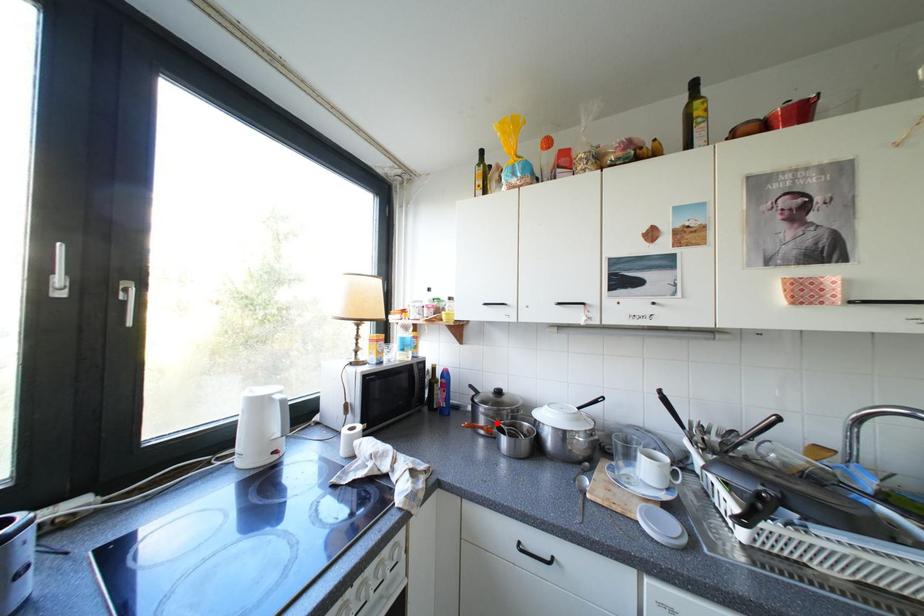
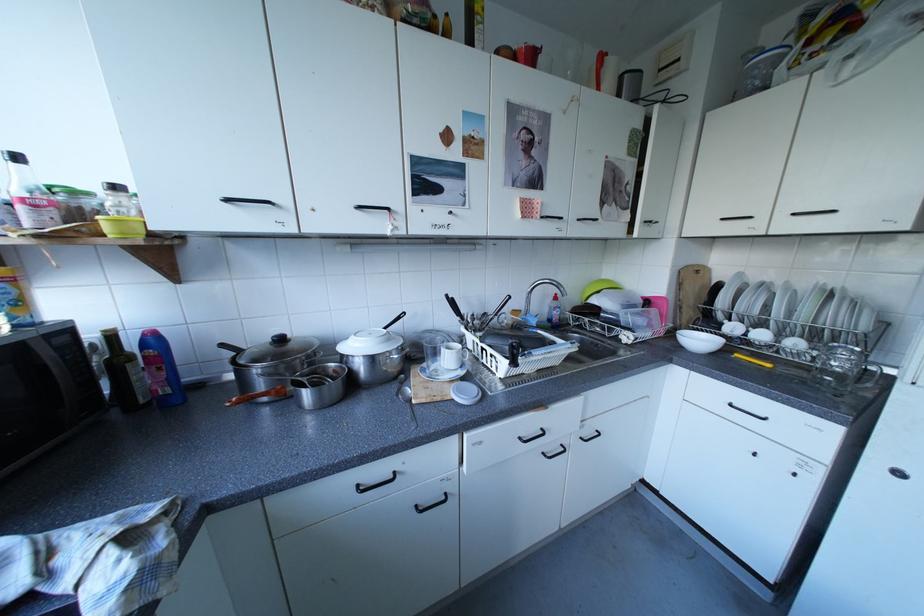
The point at the highlighted location is marked in the first image. Where is the corresponding point in the second image?

(281, 386)